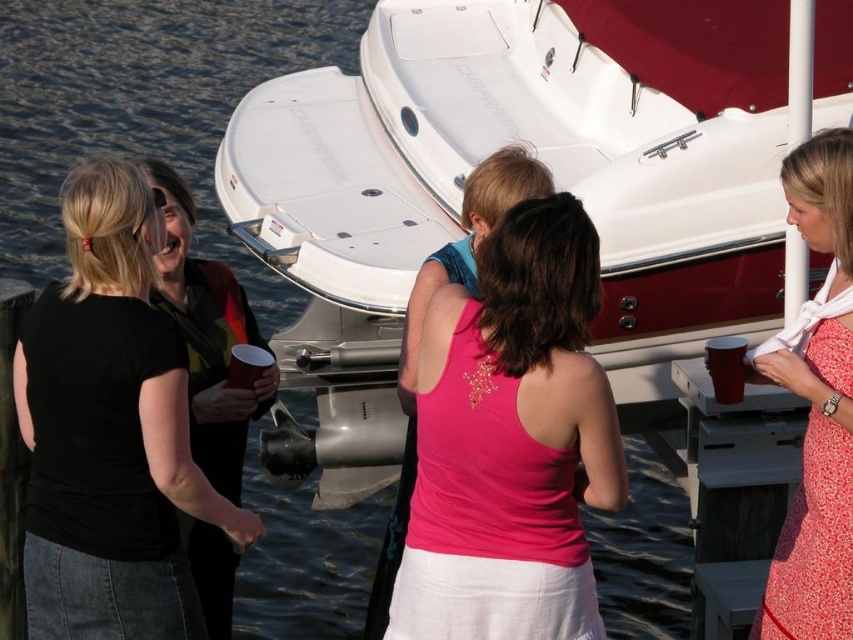
Question: Is white glossy boat at center bigger than floral dress at center?

Choices:
 (A) yes
 (B) no

Answer: (A)

Question: Estimate the real-world distances between objects in this image. Which object is closer to the pink fabric tank top at center?

Choices:
 (A) floral dress at center
 (B) gray metallic dock at lower right

Answer: (A)

Question: Can you confirm if white glossy boat at center is wider than black matte shirt at left?

Choices:
 (A) yes
 (B) no

Answer: (A)

Question: Which object appears closest to the camera in this image?

Choices:
 (A) floral dress at center
 (B) pink fabric tank top at center
 (C) black matte shirt at left

Answer: (B)

Question: Does white glossy boat at center come behind pink fabric tank top at center?

Choices:
 (A) no
 (B) yes

Answer: (B)

Question: Which object is farther from the camera taking this photo?

Choices:
 (A) black matte shirt at left
 (B) white glossy boat at center

Answer: (B)